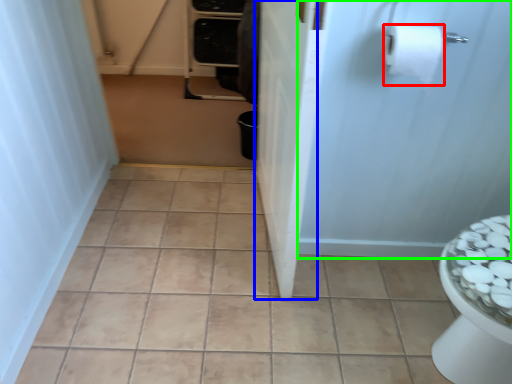
Question: Based on their relative distances, which object is farther from toilet paper (highlighted by a red box)? Choose from screen door (highlighted by a blue box) and screen door (highlighted by a green box).

Choices:
 (A) screen door
 (B) screen door

Answer: (A)